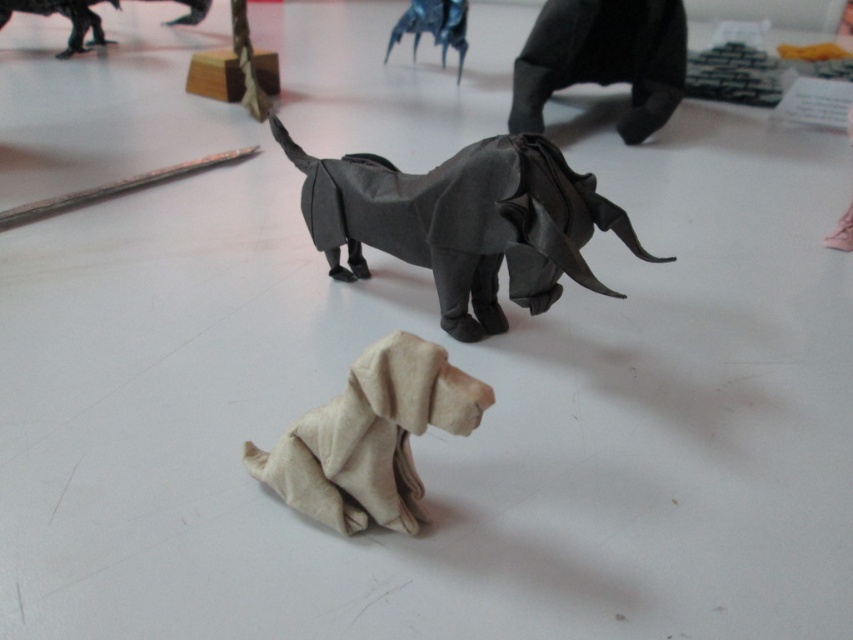
Question: Is beige paper dog at lower center thinner than shiny metallic robot at upper left?

Choices:
 (A) yes
 (B) no

Answer: (B)

Question: Which is farther from the dark gray paper elephant at center?

Choices:
 (A) metallic blue origami spider at upper center
 (B) matte gray origami elephant at upper right
 (C) shiny metallic robot at upper left

Answer: (C)

Question: Among these objects, which one is nearest to the camera?

Choices:
 (A) matte gray origami elephant at upper right
 (B) dark gray paper elephant at center
 (C) metallic blue origami spider at upper center
 (D) shiny metallic robot at upper left

Answer: (B)

Question: Which object appears closest to the camera in this image?

Choices:
 (A) shiny metallic robot at upper left
 (B) beige paper dog at lower center
 (C) dark gray paper elephant at center
 (D) matte gray origami elephant at upper right

Answer: (B)

Question: From the image, what is the correct spatial relationship of beige paper dog at lower center in relation to shiny metallic robot at upper left?

Choices:
 (A) below
 (B) above

Answer: (A)

Question: Is dark gray paper elephant at center behind beige paper dog at lower center?

Choices:
 (A) no
 (B) yes

Answer: (B)